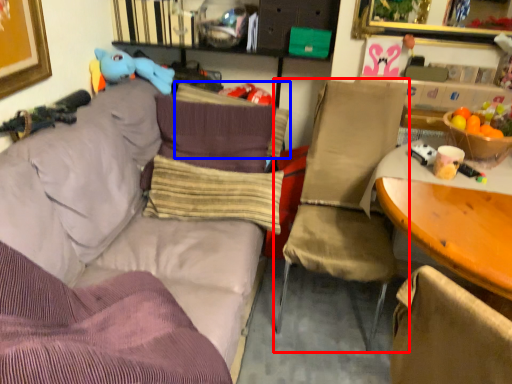
Question: Which point is further to the camera, chair (highlighted by a red box) or pillow (highlighted by a blue box)?

Choices:
 (A) chair
 (B) pillow

Answer: (B)